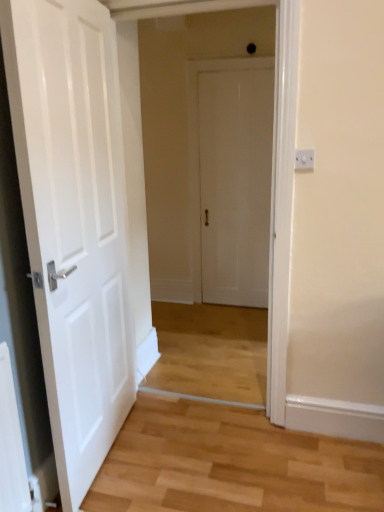
Question: Considering the relative sizes of white matte door at center, which is the 1th door in left-to-right order, and white matte door at center, the second door in the front-to-back sequence, in the image provided, is white matte door at center, which is the 1th door in left-to-right order, taller than white matte door at center, the second door in the front-to-back sequence,?

Choices:
 (A) no
 (B) yes

Answer: (B)

Question: Is white matte door at center, placed as the 2th door when sorted from right to left, bigger than white matte door at center, which ranks as the 1th door in right-to-left order?

Choices:
 (A) yes
 (B) no

Answer: (A)

Question: Can you confirm if white matte door at center, placed as the second door when sorted from back to front, is thinner than white matte door at center, the second door in the front-to-back sequence?

Choices:
 (A) yes
 (B) no

Answer: (B)

Question: Is white matte door at center, placed as the 2th door when sorted from right to left, next to white matte door at center, the second door in the front-to-back sequence, and touching it?

Choices:
 (A) yes
 (B) no

Answer: (B)

Question: Can you confirm if white matte door at center, placed as the second door when sorted from back to front, is positioned to the right of white matte door at center, the second door in the front-to-back sequence?

Choices:
 (A) no
 (B) yes

Answer: (A)

Question: Is point (231, 134) positioned closer to the camera than point (92, 297)?

Choices:
 (A) farther
 (B) closer

Answer: (A)

Question: Is white matte door at center, which is the 2th door in left-to-right order, bigger or smaller than white matte door at center, placed as the 2th door when sorted from right to left?

Choices:
 (A) small
 (B) big

Answer: (A)

Question: Is white matte door at center, which ranks as the 1th door in right-to-left order, in front of or behind white matte door at center, the first door when ordered from front to back, in the image?

Choices:
 (A) front
 (B) behind

Answer: (B)

Question: Is white matte door at center, the second door in the front-to-back sequence, to the left or to the right of white matte door at center, placed as the 2th door when sorted from right to left, in the image?

Choices:
 (A) left
 (B) right

Answer: (B)

Question: Choose the correct answer: Is white plastic switch at upper right inside white matte door at center, which is the 1th door in left-to-right order, or outside it?

Choices:
 (A) inside
 (B) outside

Answer: (B)

Question: Visually, is white plastic switch at upper right positioned to the left or to the right of white matte door at center, the first door when ordered from front to back?

Choices:
 (A) right
 (B) left

Answer: (A)

Question: Considering the positions of point (299, 162) and point (54, 207), is point (299, 162) closer or farther from the camera than point (54, 207)?

Choices:
 (A) closer
 (B) farther

Answer: (B)

Question: Considering the positions of white plastic switch at upper right and white matte door at center, placed as the 2th door when sorted from right to left, in the image, is white plastic switch at upper right wider or thinner than white matte door at center, placed as the 2th door when sorted from right to left,?

Choices:
 (A) wide
 (B) thin

Answer: (B)

Question: In terms of size, does white matte door at center, placed as the second door when sorted from back to front, appear bigger or smaller than white matte door at center, the 1th door positioned from the back?

Choices:
 (A) big
 (B) small

Answer: (A)

Question: Is point (57, 389) closer or farther from the camera than point (241, 259)?

Choices:
 (A) closer
 (B) farther

Answer: (A)